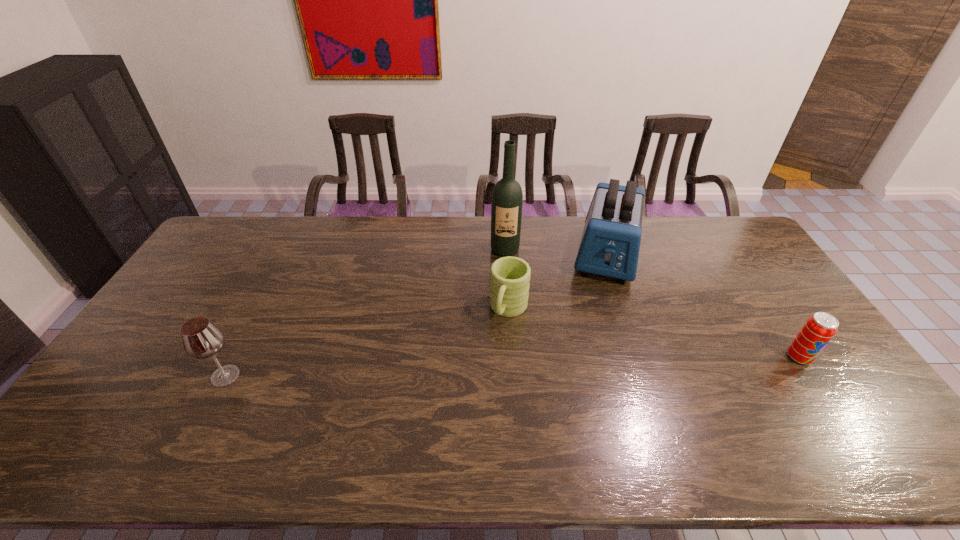
Find the location of a particular element. Image resolution: width=960 pixels, height=540 pixels. vacant space that is in between the leftmost object and the tallest object is located at coordinates (365, 313).

Image resolution: width=960 pixels, height=540 pixels. I want to click on unoccupied area between the soda can and the toaster, so click(703, 306).

Find the location of a particular element. Image resolution: width=960 pixels, height=540 pixels. vacant space that's between the rightmost object and the third nearest object is located at coordinates (654, 333).

The image size is (960, 540). Identify the location of empty location between the fourth shortest object and the soda can. tap(703, 306).

This screenshot has height=540, width=960. In order to click on the third closest object to the third tallest object in this screenshot , I will do `click(610, 243)`.

Identify which object is the nearest to the second object from right to left. Please provide its 2D coordinates. Your answer should be formatted as a tuple, i.e. [(x, y)], where the tuple contains the x and y coordinates of a point satisfying the conditions above.

[(509, 284)]

Identify the location of vacant area in the image that satisfies the following two spatial constraints: 1. on the back side of the mug; 2. on the right side of the toaster. (505, 254).

In order to click on blank area in the image that satisfies the following two spatial constraints: 1. on the back side of the toaster; 2. on the right side of the wineglass in this screenshot , I will do `click(288, 254)`.

This screenshot has height=540, width=960. In order to click on free space that satisfies the following two spatial constraints: 1. on the back side of the third nearest object; 2. on the right side of the toaster in this screenshot , I will do `click(505, 254)`.